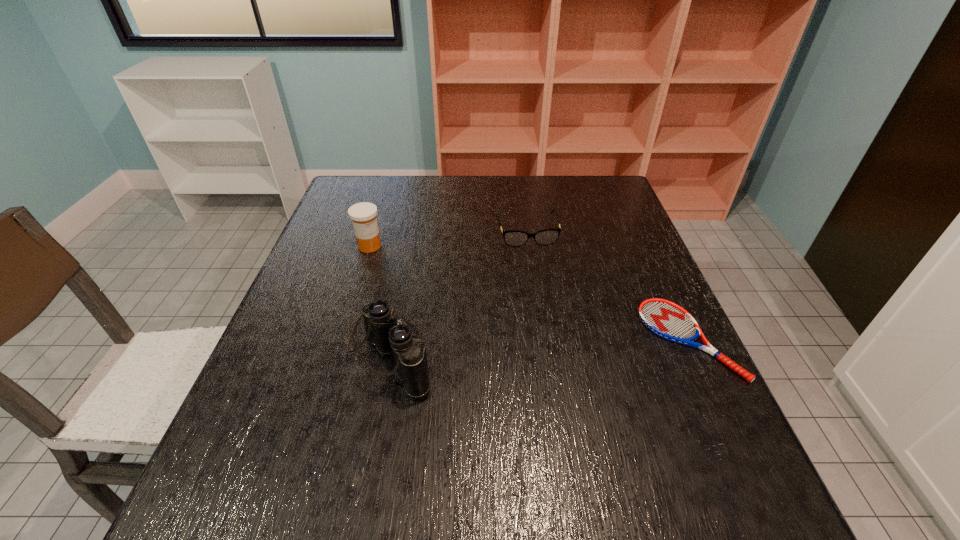
Identify the location of vacant space at the far right corner. This screenshot has height=540, width=960. (610, 197).

Find the location of a particular element. This screenshot has height=540, width=960. free location at the near right corner is located at coordinates (711, 429).

Identify the location of unoccupied area between the rightmost object and the medicine. The height and width of the screenshot is (540, 960). (529, 293).

The image size is (960, 540). I want to click on free space between the second shortest object and the tennis racket, so click(x=608, y=286).

This screenshot has height=540, width=960. Identify the location of free space between the second shortest object and the shortest object. (608, 286).

Find the location of a particular element. The width and height of the screenshot is (960, 540). free space between the second object from right to left and the shortest object is located at coordinates (608, 286).

Find the location of a particular element. The image size is (960, 540). free space between the rightmost object and the second tallest object is located at coordinates (529, 293).

Find the location of a particular element. vacant region between the spectacles and the third shortest object is located at coordinates (447, 239).

Where is `vacant space that is in between the rightmost object and the medicine`? Image resolution: width=960 pixels, height=540 pixels. vacant space that is in between the rightmost object and the medicine is located at coordinates (529, 293).

Identify the location of vacant area that lies between the medicine and the shortest object. (529, 293).